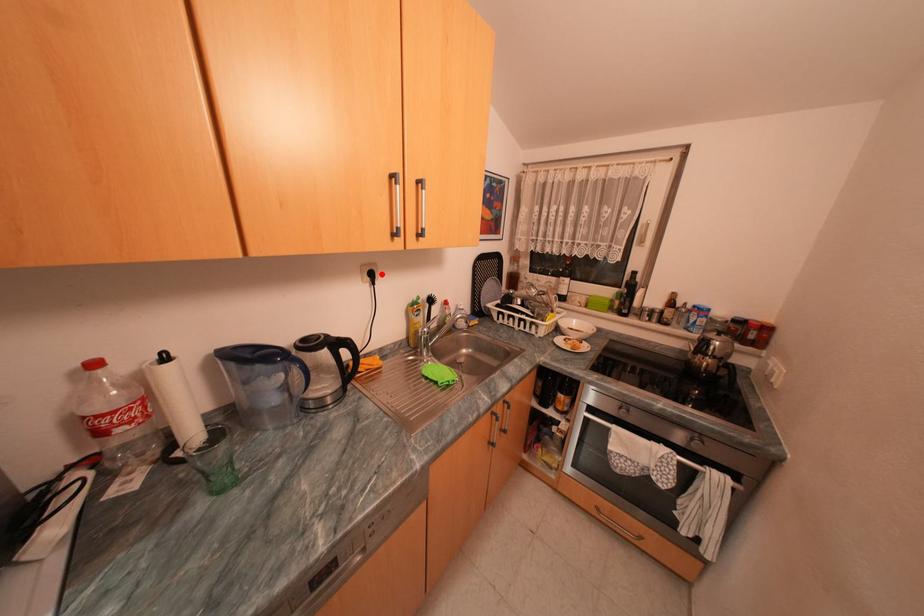
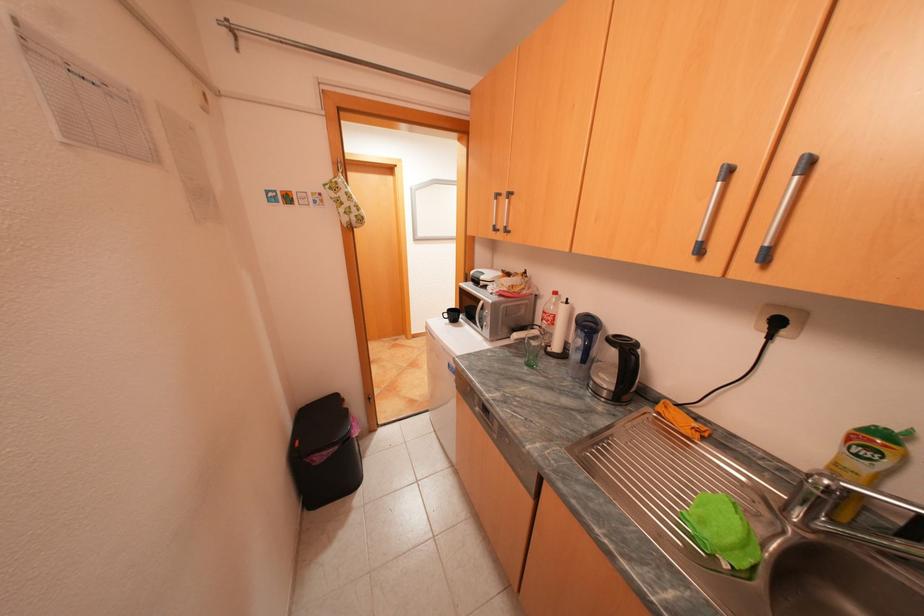
Where in the second image is the point corresponding to the highlighted location from the first image?

(786, 323)